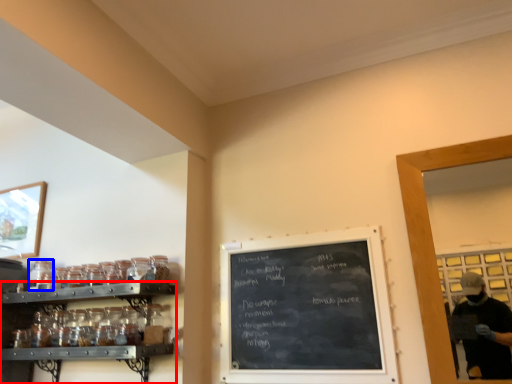
Question: Among these objects, which one is nearest to the camera, shelf (highlighted by a red box) or glass jar (highlighted by a blue box)?

Choices:
 (A) shelf
 (B) glass jar

Answer: (A)